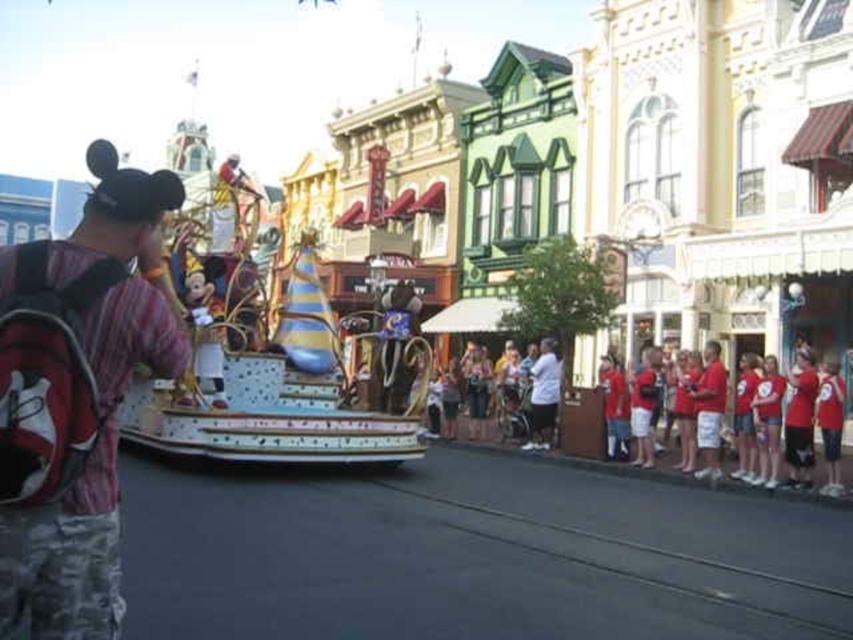
You are a photographer standing at the center of the scene. You want to take a picture of the striped cotton shirt at left. Where should you point your camera relative to the parade float?

The striped cotton shirt at left is located at point (76,400), so you should point your camera to the left side of the parade float to capture it.

You are standing at the center of the parade float and looking towards the Mickey Mouse character. Which direction should you turn to face the striped cotton shirt at left located at point [76,400]?

The striped cotton shirt at left located at point [76,400] is to the left of the parade float. Since you are facing the Mickey Mouse character, turning to your left will orient you towards the striped cotton shirt at left located at point [76,400].